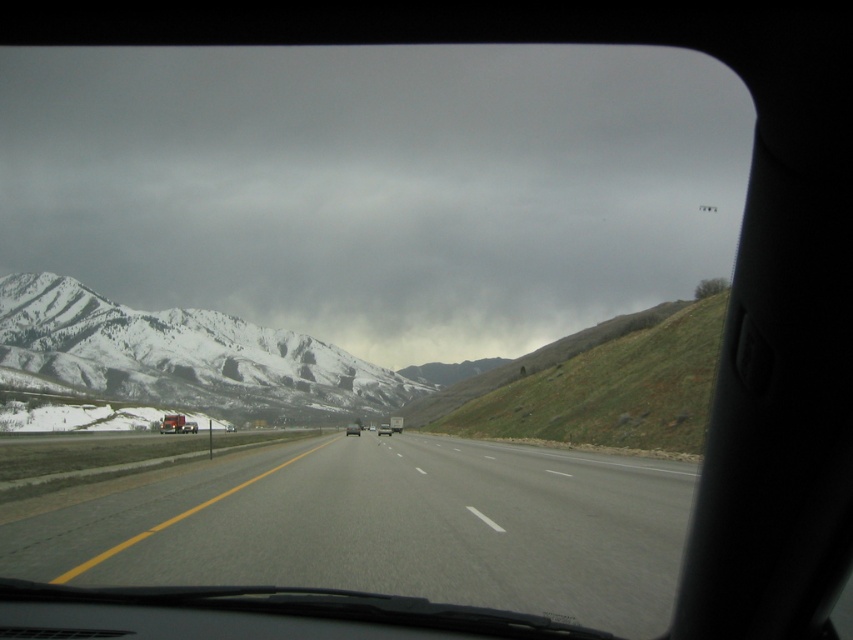
You are a passenger in the car and looking out the window. You see the gray cloudy sky at upper center and the silver metallic sedan at center. Which object is positioned to the left of the other?

The gray cloudy sky at upper center is to the left of the silver metallic sedan at center according to the description.

In the scene shown: You are driving a car and see two trucks ahead on the highway. The metallic silver truck at left and the silver metallic truck at center. Which truck is closer to the left edge of the road?

The metallic silver truck at left is closer to the left edge of the road because it is positioned on the left side of the silver metallic truck at center.